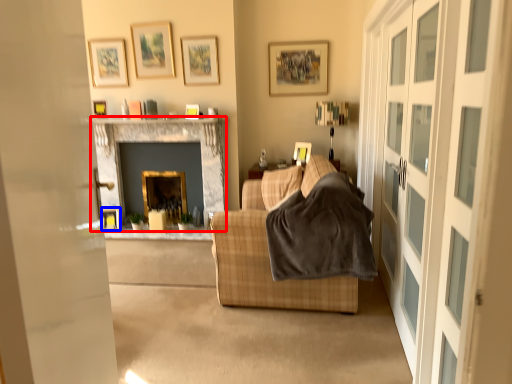
Question: Which point is further to the camera, fireplace (highlighted by a red box) or picture frame (highlighted by a blue box)?

Choices:
 (A) fireplace
 (B) picture frame

Answer: (B)